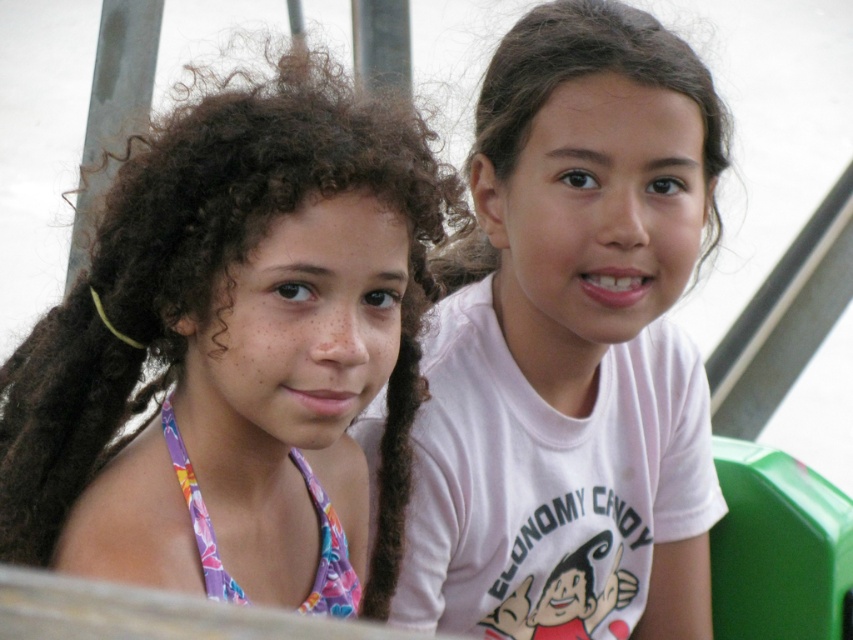
Question: Among these objects, which one is nearest to the camera?

Choices:
 (A) multicolored fabric bikini top at lower left
 (B) white matte shirt at center

Answer: (A)

Question: Does matte purple swimsuit at left have a larger size compared to white matte shirt at center?

Choices:
 (A) no
 (B) yes

Answer: (A)

Question: Which point appears closest to the camera in this image?

Choices:
 (A) (294, 417)
 (B) (650, 449)

Answer: (A)

Question: Is matte purple swimsuit at left to the left of white matte shirt at center from the viewer's perspective?

Choices:
 (A) yes
 (B) no

Answer: (A)

Question: Among these points, which one is farthest from the camera?

Choices:
 (A) (358, 205)
 (B) (622, 573)

Answer: (B)

Question: Does matte purple swimsuit at left have a lesser width compared to multicolored fabric bikini top at lower left?

Choices:
 (A) yes
 (B) no

Answer: (B)